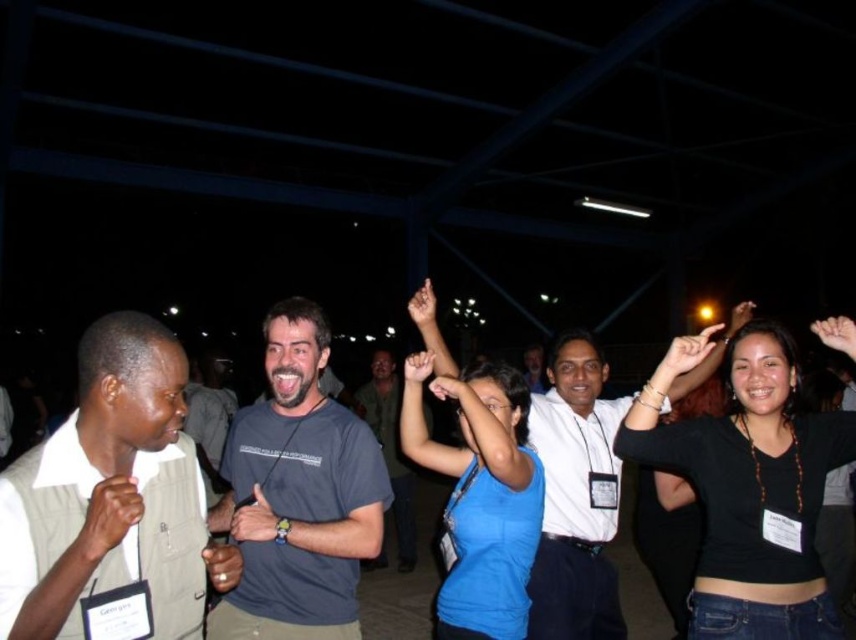
You are standing at the point labeled as point (596, 609). You want to throw a ball to someone standing at the other end of the gathering. If the distance between you and them is 9.57 feet, can you reach them if your maximum throwing distance is 10 feet?

Yes, you can reach them because the distance between you and them is 9.57 feet, which is within your maximum throwing distance of 10 feet.

You are at a nighttime gathering and want to find the person wearing a white shirt at center. Can you tell me where the point at coordinate [575,497] is located?

Answer: The point at coordinate [575,497] is located on the white shirt at center.